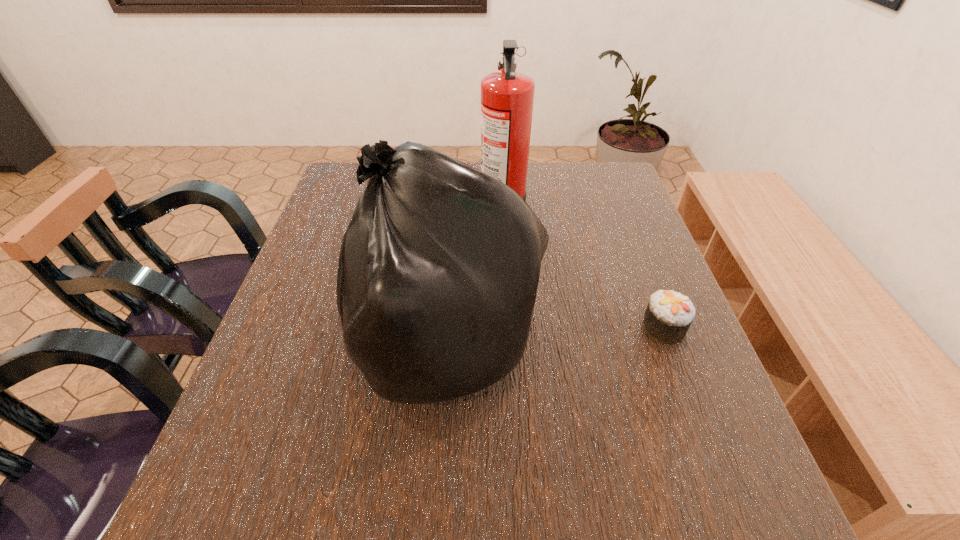
I want to click on object that is at the left edge, so click(x=439, y=267).

Identify the location of object located in the right edge section of the desktop. This screenshot has width=960, height=540. (669, 314).

The image size is (960, 540). In the image, there is a desktop. Find the location of `free space at the near edge`. free space at the near edge is located at coordinates (508, 485).

Find the location of a particular element. This screenshot has width=960, height=540. vacant space at the left edge of the desktop is located at coordinates (290, 290).

Where is `free region at the right edge of the desktop`? free region at the right edge of the desktop is located at coordinates (675, 387).

This screenshot has height=540, width=960. I want to click on vacant space at the far right corner of the desktop, so click(x=608, y=162).

Locate an element on the screen. This screenshot has width=960, height=540. vacant area between the plastic bag and the shortest object is located at coordinates (553, 334).

I want to click on free space between the cupcake and the fire extinguisher, so click(583, 266).

Where is `free spot between the farthest object and the rightmost object`? The width and height of the screenshot is (960, 540). free spot between the farthest object and the rightmost object is located at coordinates (583, 266).

The height and width of the screenshot is (540, 960). I want to click on free space between the plastic bag and the shortest object, so click(553, 334).